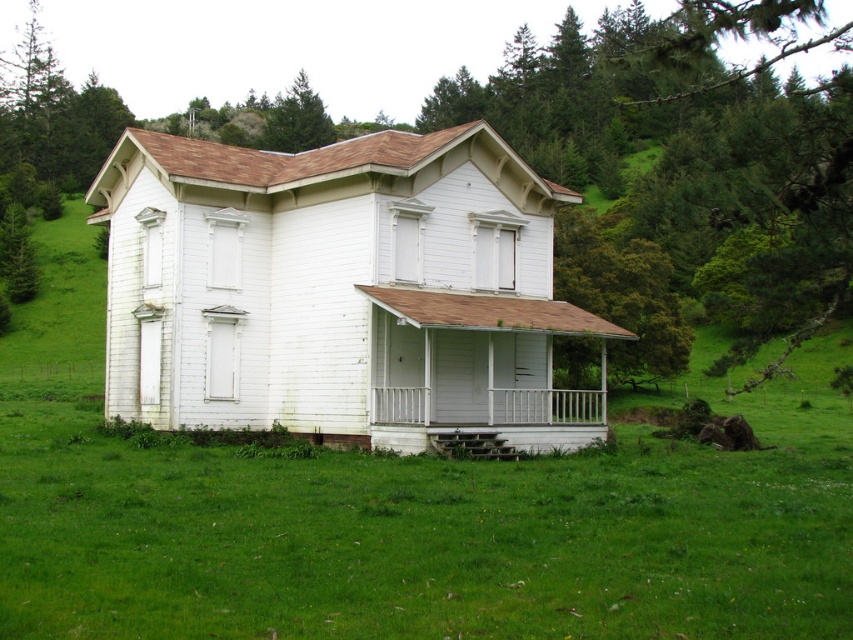
Question: Considering the real-world distances, which object is closest to the white wooden porch at center?

Choices:
 (A) green textured tree at upper center
 (B) white wood house at center

Answer: (B)

Question: Which object is positioned farthest from the white wood house at center?

Choices:
 (A) green textured tree at upper center
 (B) white wooden porch at center

Answer: (A)

Question: Is white wood house at center below white wooden porch at center?

Choices:
 (A) yes
 (B) no

Answer: (B)

Question: Which of the following is the closest to the observer?

Choices:
 (A) (489, 394)
 (B) (236, 152)
 (C) (281, 148)

Answer: (A)

Question: Can you confirm if white wooden porch at center is wider than green textured tree at upper center?

Choices:
 (A) yes
 (B) no

Answer: (B)

Question: Can you confirm if white wood house at center is positioned above green textured tree at upper center?

Choices:
 (A) yes
 (B) no

Answer: (B)